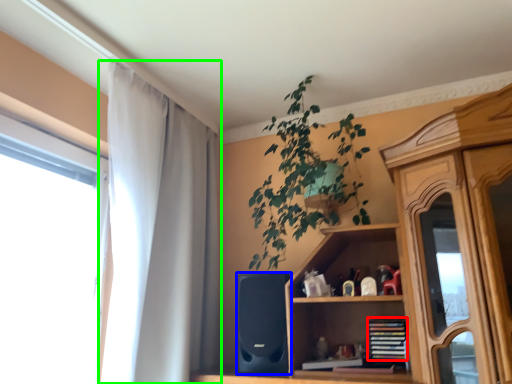
Question: Estimate the real-world distances between objects in this image. Which object is farther from book (highlighted by a red box), speaker (highlighted by a blue box) or curtain (highlighted by a green box)?

Choices:
 (A) speaker
 (B) curtain

Answer: (B)